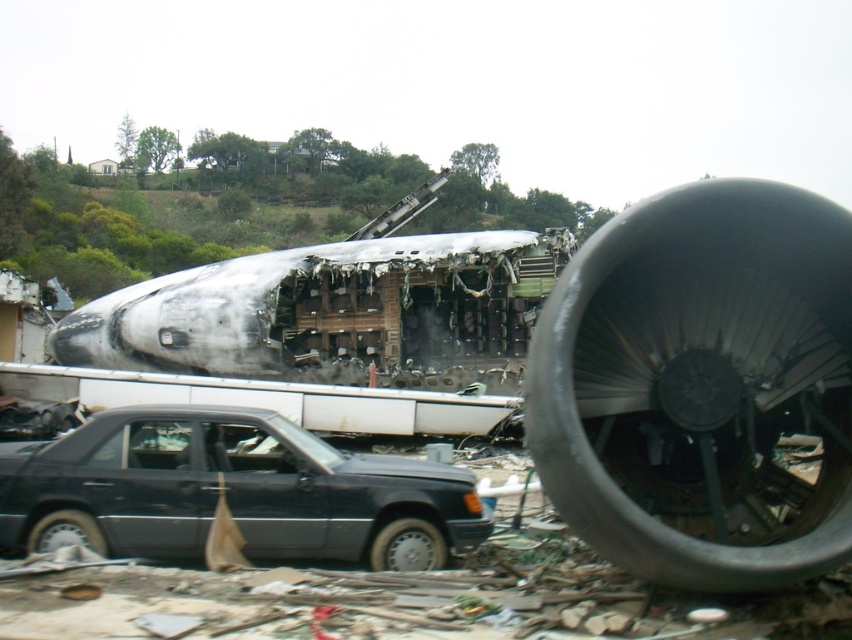
Question: Does matte black sedan at lower left have a larger size compared to silver metallic tire at lower center?

Choices:
 (A) no
 (B) yes

Answer: (B)

Question: Which of the following is the farthest from the observer?

Choices:
 (A) black rubber tire at lower left
 (B) matte black sedan at lower left
 (C) silver metallic tire at lower center

Answer: (C)

Question: Is matte black sedan at lower left smaller than silver metallic tire at lower center?

Choices:
 (A) no
 (B) yes

Answer: (A)

Question: Among these points, which one is farthest from the camera?

Choices:
 (A) (154, 481)
 (B) (432, 547)

Answer: (B)

Question: Which point is farther to the camera?

Choices:
 (A) matte black sedan at lower left
 (B) black rubber tire at lower left

Answer: (B)

Question: Is silver metallic tire at lower center bigger than black rubber tire at lower left?

Choices:
 (A) no
 (B) yes

Answer: (B)